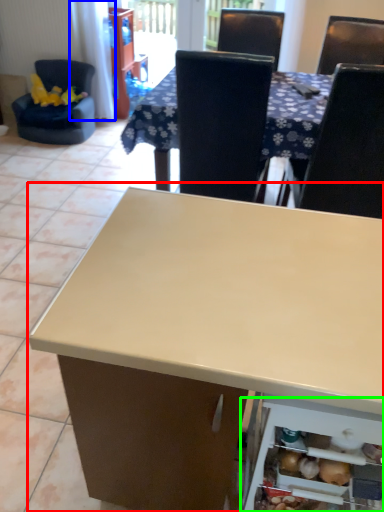
Question: Which object is the closest to the table (highlighted by a red box)? Choose among these: curtain (highlighted by a blue box) or shelf (highlighted by a green box).

Choices:
 (A) curtain
 (B) shelf

Answer: (B)